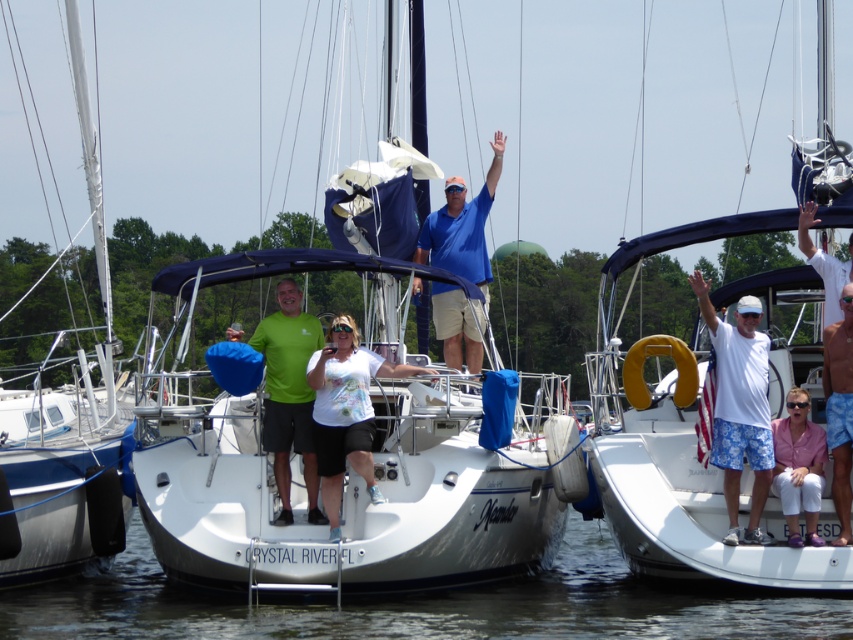
You are standing on the dock and looking at the clear water at lower center and the blue cotton shirt at center. Which object is closer to the water surface?

The clear water at lower center is closer to the water surface since it has a lesser height compared to the blue cotton shirt at center.

You are a photographer planning to capture a wide shot of the white matte sailboat at center and the pink fabric shirt at lower right. Given their widths, which object will appear wider in the photograph?

The white matte sailboat at center will appear wider in the photograph because its width surpasses that of the pink fabric shirt at lower right.

You are a photographer planning to take a photo of the white matte boat at center and the pink fabric shirt at lower right. Since you want to ensure both are visible in the frame, which object should you focus on first to account for their sizes?

The white matte boat at center is larger than the pink fabric shirt at lower right, so you should focus on the white matte boat at center first to ensure it fits properly in the frame before adjusting for the smaller pink fabric shirt at lower right.